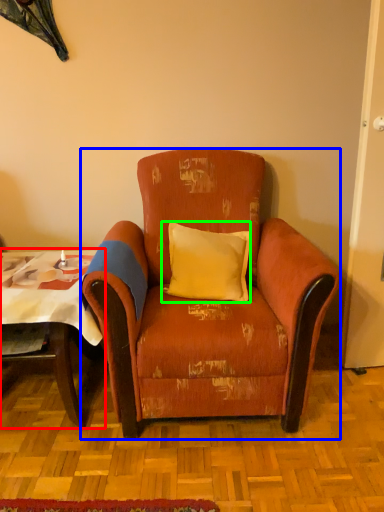
Question: Which object is positioned farthest from table (highlighted by a red box)? Select from chair (highlighted by a blue box) and pillow (highlighted by a green box).

Choices:
 (A) chair
 (B) pillow

Answer: (B)